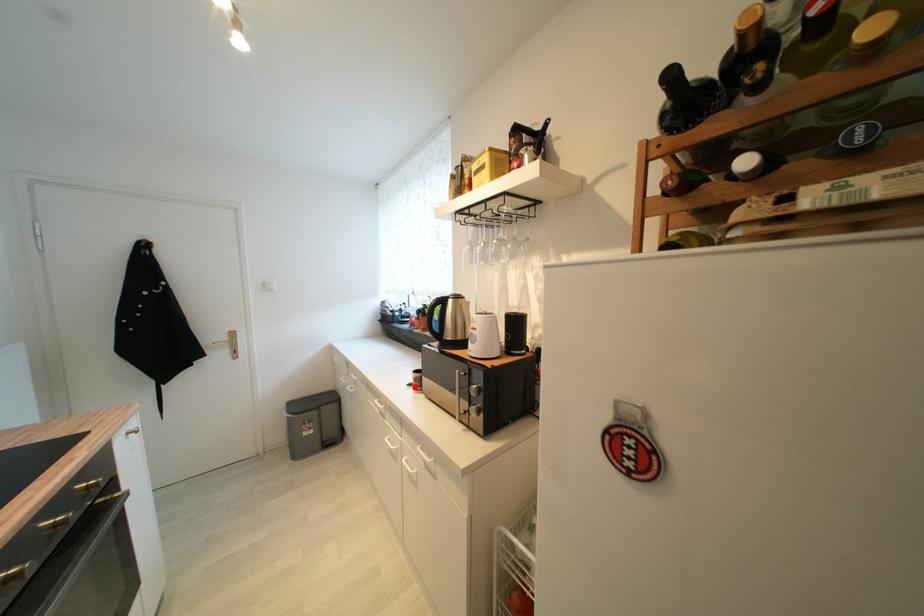
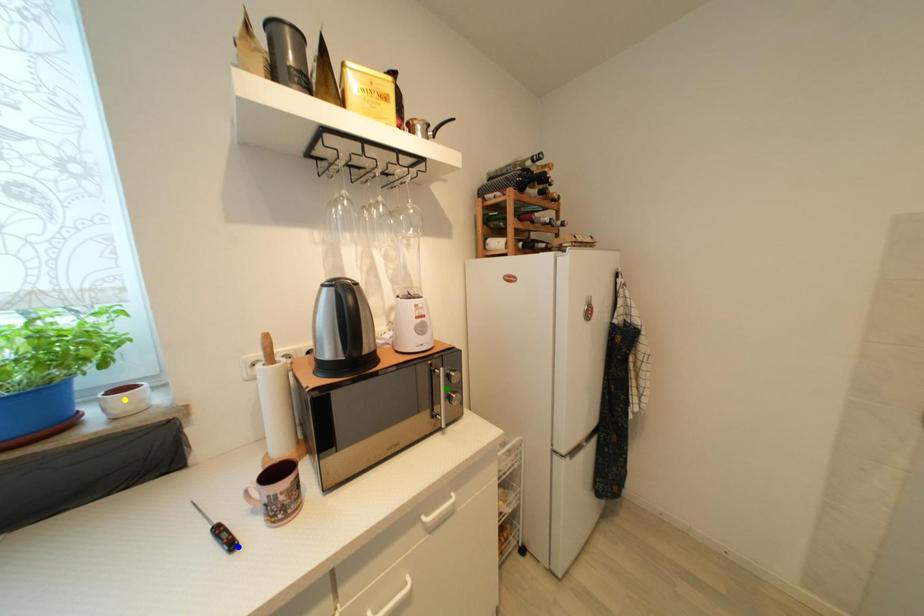
Question: I am providing you with two images of the same scene from different viewpoints. A red point is marked on the first image. You are given multiple points on the second image. Can you choose the point in image 2 that corresponds to the point in image 1?

Choices:
 (A) blue point
 (B) green point
 (C) yellow point

Answer: (A)